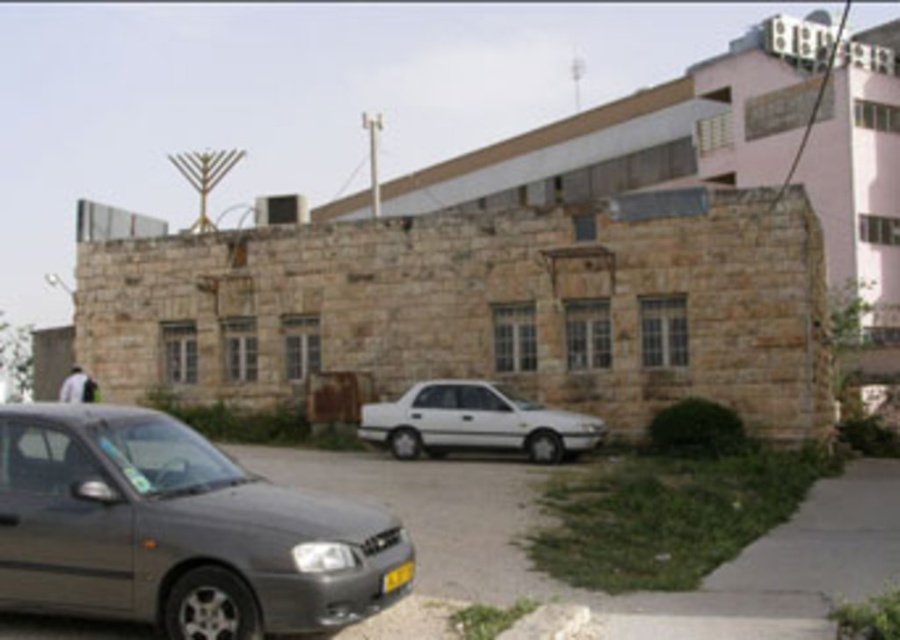
Measure the distance from metallic gray sedan at lower left to yellow matte license plate at center.

metallic gray sedan at lower left is 3.42 feet from yellow matte license plate at center.

Can you confirm if metallic gray sedan at lower left is bigger than yellow matte license plate at center?

Indeed, metallic gray sedan at lower left has a larger size compared to yellow matte license plate at center.

The width and height of the screenshot is (900, 640). Describe the element at coordinates (176, 531) in the screenshot. I see `metallic gray sedan at lower left` at that location.

Find the location of a particular element. metallic gray sedan at lower left is located at coordinates (176, 531).

Does white matte sedan at center have a larger size compared to yellow matte license plate at center?

Indeed, white matte sedan at center has a larger size compared to yellow matte license plate at center.

Is white matte sedan at center smaller than yellow matte license plate at center?

Actually, white matte sedan at center might be larger than yellow matte license plate at center.

This screenshot has height=640, width=900. What do you see at coordinates (475, 422) in the screenshot? I see `white matte sedan at center` at bounding box center [475, 422].

The width and height of the screenshot is (900, 640). In order to click on white matte sedan at center in this screenshot , I will do `click(475, 422)`.

This screenshot has width=900, height=640. Describe the element at coordinates (176, 531) in the screenshot. I see `metallic gray sedan at lower left` at that location.

Can you confirm if metallic gray sedan at lower left is smaller than white matte sedan at center?

Correct, metallic gray sedan at lower left occupies less space than white matte sedan at center.

This screenshot has width=900, height=640. In order to click on metallic gray sedan at lower left in this screenshot , I will do `click(176, 531)`.